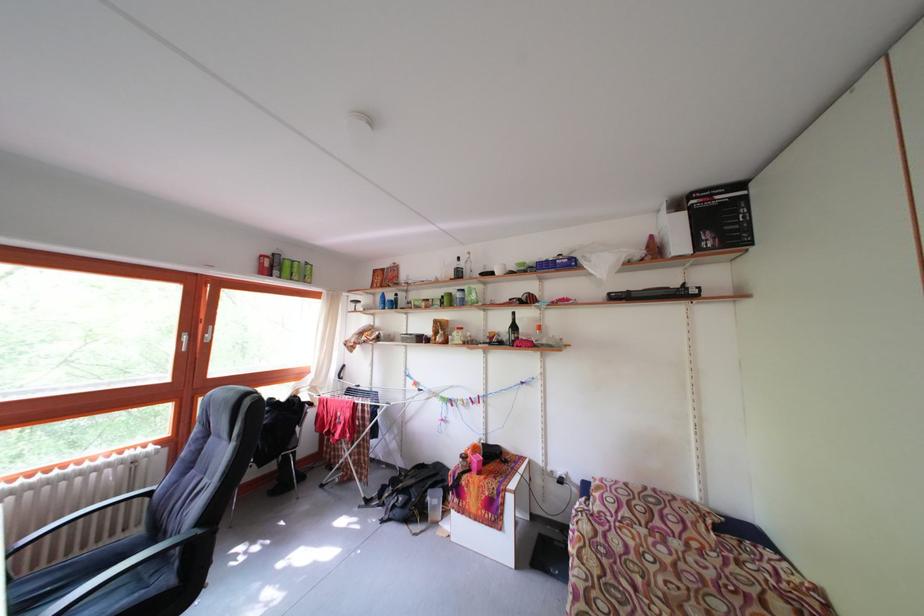
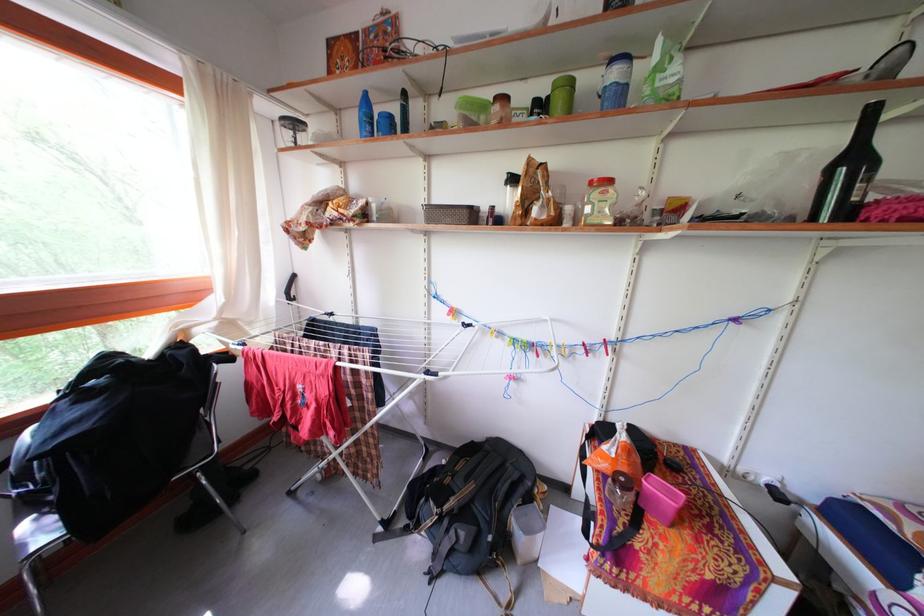
In a continuous first-person perspective shot, in which direction is the camera moving?

The movement direction of the cameraman is left, forward.